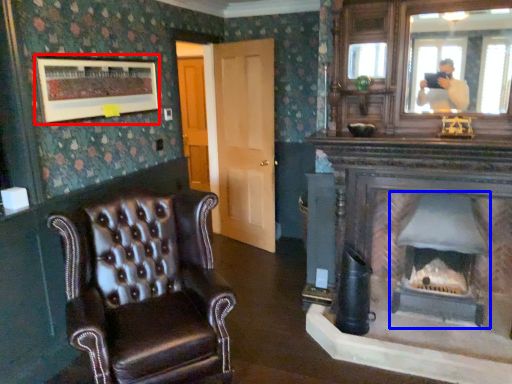
Question: Which object is closer to the camera taking this photo, picture frame (highlighted by a red box) or fireplace (highlighted by a blue box)?

Choices:
 (A) picture frame
 (B) fireplace

Answer: (A)